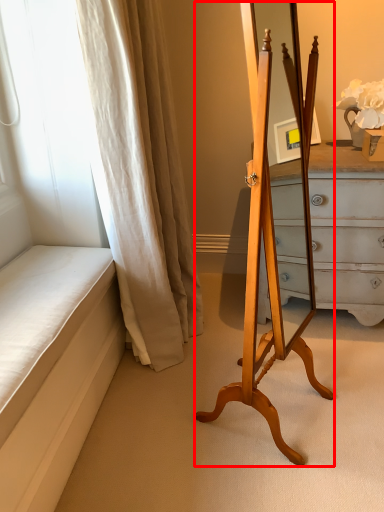
Question: From the image, what is the correct spatial relationship of easel (annotated by the red box) in relation to curtain?

Choices:
 (A) right
 (B) left

Answer: (A)